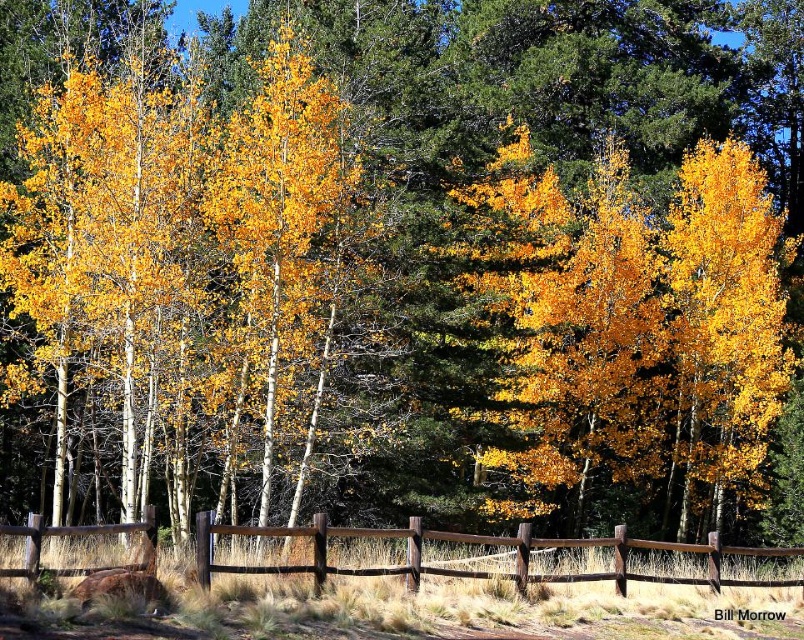
Consider the image. You are standing in the autumn forest scene described. You notice a specific point marked at coordinates point (x=725, y=320). What object is located at this point?

The point (x=725, y=320) marks the location of the matte yellow birch at right.

You are standing in the autumn forest scene and notice two points marked in the image. The first point is at coordinates point (259, 212) and the second is at point (322, 548). Which of these two points is closer to you?

Point (259, 212) is closer to you because it is further to the viewer than point (322, 548).

You are an artist trying to sketch this autumn scene. You notice the golden yellow bark birch at center and the brown wooden fence at center. Which object should you draw first if you want to follow the rule of drawing thinner objects before thicker ones?

The golden yellow bark birch at center should be drawn first because it is thinner than the brown wooden fence at center.